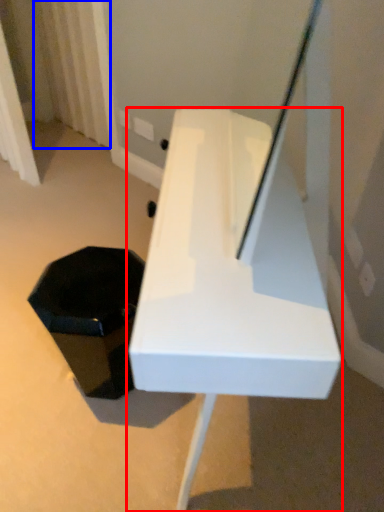
Question: Among these objects, which one is farthest to the camera, furniture (highlighted by a red box) or curtain (highlighted by a blue box)?

Choices:
 (A) furniture
 (B) curtain

Answer: (B)